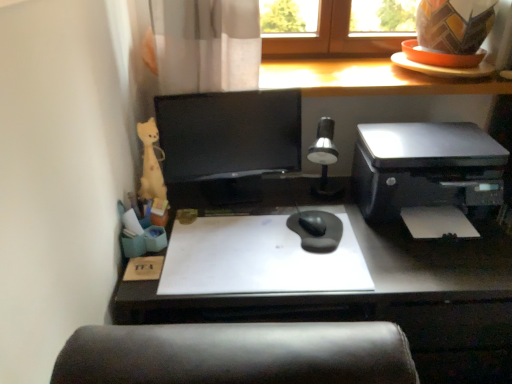
Question: Is matte wood counter top at upper center beside yellow plush toy at left?

Choices:
 (A) no
 (B) yes

Answer: (A)

Question: Is yellow plush toy at left inside matte wood counter top at upper center?

Choices:
 (A) yes
 (B) no

Answer: (B)

Question: From a real-world perspective, is matte wood counter top at upper center located beneath yellow plush toy at left?

Choices:
 (A) yes
 (B) no

Answer: (B)

Question: Does matte wood counter top at upper center have a lesser width compared to yellow plush toy at left?

Choices:
 (A) no
 (B) yes

Answer: (A)

Question: Is matte wood counter top at upper center taller than yellow plush toy at left?

Choices:
 (A) no
 (B) yes

Answer: (A)

Question: Considering the relative sizes of matte wood counter top at upper center and yellow plush toy at left in the image provided, is matte wood counter top at upper center smaller than yellow plush toy at left?

Choices:
 (A) no
 (B) yes

Answer: (A)

Question: Considering the relative sizes of silver metallic table lamp at center and satin black printer at right in the image provided, is silver metallic table lamp at center taller than satin black printer at right?

Choices:
 (A) no
 (B) yes

Answer: (B)

Question: Does silver metallic table lamp at center come in front of satin black printer at right?

Choices:
 (A) no
 (B) yes

Answer: (A)

Question: From a real-world perspective, is silver metallic table lamp at center positioned under satin black printer at right based on gravity?

Choices:
 (A) yes
 (B) no

Answer: (B)

Question: Does silver metallic table lamp at center have a lesser height compared to satin black printer at right?

Choices:
 (A) yes
 (B) no

Answer: (B)

Question: Is silver metallic table lamp at center to the left of satin black printer at right from the viewer's perspective?

Choices:
 (A) no
 (B) yes

Answer: (B)

Question: From the image's perspective, is silver metallic table lamp at center over satin black printer at right?

Choices:
 (A) yes
 (B) no

Answer: (B)

Question: Does silver metallic table lamp at center have a greater width compared to black glossy monitor at center?

Choices:
 (A) no
 (B) yes

Answer: (B)